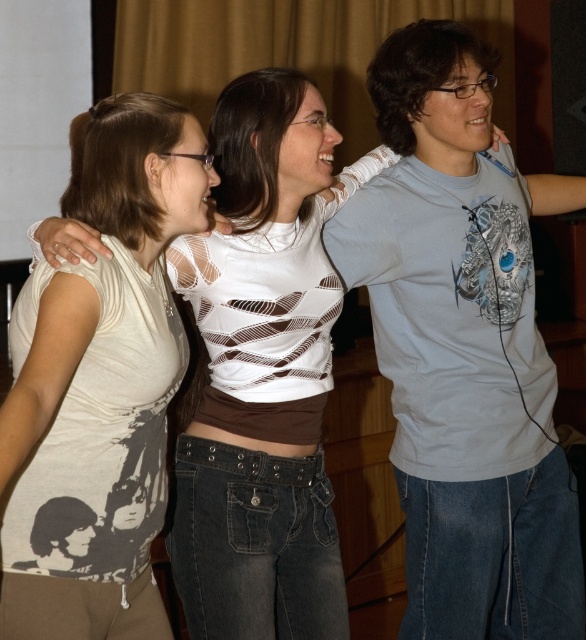
Which of these two, white printed tank top at center or white printed shirt at center, stands shorter?

Standing shorter between the two is white printed tank top at center.

Does white printed tank top at center have a greater width compared to white printed shirt at center?

No.

Which is in front, point (131, 385) or point (270, 211)?

Point (131, 385) is in front.

Find the location of a particular element. white printed tank top at center is located at coordinates (100, 381).

Between light gray cotton t-shirt at center and white printed tank top at center, which one appears on the left side from the viewer's perspective?

From the viewer's perspective, white printed tank top at center appears more on the left side.

Between light gray cotton t-shirt at center and white printed tank top at center, which one appears on the right side from the viewer's perspective?

light gray cotton t-shirt at center is more to the right.

This screenshot has height=640, width=586. Describe the element at coordinates (464, 348) in the screenshot. I see `light gray cotton t-shirt at center` at that location.

Where is `light gray cotton t-shirt at center`? This screenshot has width=586, height=640. light gray cotton t-shirt at center is located at coordinates point(464,348).

Can you confirm if light gray cotton t-shirt at center is positioned below white printed shirt at center?

No, light gray cotton t-shirt at center is not below white printed shirt at center.

Is light gray cotton t-shirt at center thinner than white printed shirt at center?

No.

At what (x,y) coordinates should I click in order to perform the action: click on light gray cotton t-shirt at center. Please return your answer as a coordinate pair (x, y). The width and height of the screenshot is (586, 640). Looking at the image, I should click on (464, 348).

You are a GUI agent. You are given a task and a screenshot of the screen. Output one action in this format:
    pyautogui.click(x=<x>, y=<y>)
    Task: Click on the light gray cotton t-shirt at center
    
    Given the screenshot: What is the action you would take?
    pyautogui.click(x=464, y=348)